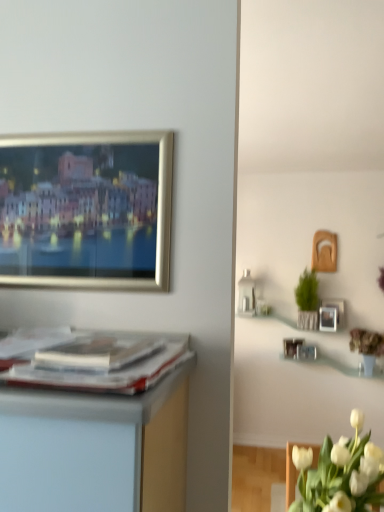
Question: From a real-world perspective, is green woven basket at upper right over matte paper magazine at center?

Choices:
 (A) no
 (B) yes

Answer: (A)

Question: Is green woven basket at upper right located outside matte paper magazine at center?

Choices:
 (A) no
 (B) yes

Answer: (B)

Question: Would you say green woven basket at upper right contains matte paper magazine at center?

Choices:
 (A) yes
 (B) no

Answer: (B)

Question: Is green woven basket at upper right smaller than matte paper magazine at center?

Choices:
 (A) yes
 (B) no

Answer: (B)

Question: Would you say green woven basket at upper right is a long distance from matte paper magazine at center?

Choices:
 (A) no
 (B) yes

Answer: (B)

Question: From the image's perspective, is green woven basket at upper right above matte paper magazine at center?

Choices:
 (A) no
 (B) yes

Answer: (A)

Question: Is white matte tulip at lower right shorter than green woven basket at upper right?

Choices:
 (A) yes
 (B) no

Answer: (A)

Question: Does white matte tulip at lower right have a greater width compared to green woven basket at upper right?

Choices:
 (A) no
 (B) yes

Answer: (B)

Question: Is white matte tulip at lower right closer to the viewer compared to green woven basket at upper right?

Choices:
 (A) yes
 (B) no

Answer: (A)

Question: Does white matte tulip at lower right have a smaller size compared to green woven basket at upper right?

Choices:
 (A) no
 (B) yes

Answer: (A)

Question: From the image's perspective, is white matte tulip at lower right located beneath green woven basket at upper right?

Choices:
 (A) yes
 (B) no

Answer: (A)

Question: Does white matte tulip at lower right have a lesser width compared to green woven basket at upper right?

Choices:
 (A) yes
 (B) no

Answer: (B)

Question: Can you confirm if white matte tulip at lower right is smaller than matte silver picture frame at upper right?

Choices:
 (A) no
 (B) yes

Answer: (A)